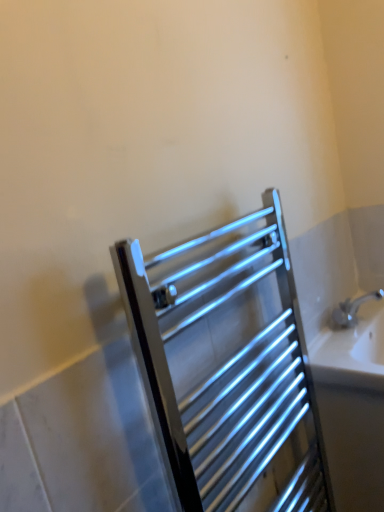
The height and width of the screenshot is (512, 384). Identify the location of chrome metallic towel rack at center. (228, 367).

This screenshot has height=512, width=384. What do you see at coordinates (228, 367) in the screenshot? I see `chrome metallic towel rack at center` at bounding box center [228, 367].

What is the approximate width of chrome metallic towel rack at center?

chrome metallic towel rack at center is 4.00 inches in width.

Where is `white glossy sink at lower right`? white glossy sink at lower right is located at coordinates (353, 407).

Describe the element at coordinates (353, 407) in the screenshot. The image size is (384, 512). I see `white glossy sink at lower right` at that location.

In order to click on chrome metallic towel rack at center in this screenshot , I will do `click(228, 367)`.

Is white glossy sink at lower right to the left or to the right of chrome metallic towel rack at center in the image?

Clearly, white glossy sink at lower right is on the right of chrome metallic towel rack at center in the image.

Is white glossy sink at lower right closer to the viewer compared to chrome metallic towel rack at center?

No, it is behind chrome metallic towel rack at center.

Is point (364, 477) closer or farther from the camera than point (203, 378)?

Clearly, point (364, 477) is more distant from the camera than point (203, 378).

From the image's perspective, is white glossy sink at lower right located above or below chrome metallic towel rack at center?

white glossy sink at lower right is situated lower than chrome metallic towel rack at center in the image.

From a real-world perspective, which is physically above, white glossy sink at lower right or chrome metallic towel rack at center?

In real-world perspective, chrome metallic towel rack at center is above.

Is white glossy sink at lower right wider or thinner than chrome metallic towel rack at center?

In the image, white glossy sink at lower right appears to be wider than chrome metallic towel rack at center.

From their relative heights in the image, would you say white glossy sink at lower right is taller or shorter than chrome metallic towel rack at center?

Clearly, white glossy sink at lower right is shorter compared to chrome metallic towel rack at center.

Which of these two, white glossy sink at lower right or chrome metallic towel rack at center, is smaller?

chrome metallic towel rack at center.

Is white glossy sink at lower right inside the boundaries of chrome metallic towel rack at center, or outside?

The correct answer is: outside.

Are white glossy sink at lower right and chrome metallic towel rack at center making contact?

No, white glossy sink at lower right is not beside chrome metallic towel rack at center.

Does white glossy sink at lower right turn towards chrome metallic towel rack at center?

No, white glossy sink at lower right is not turned towards chrome metallic towel rack at center.

What's the angular difference between white glossy sink at lower right and chrome metallic towel rack at center's facing directions?

There is a 0.783-degree angle between the facing directions of white glossy sink at lower right and chrome metallic towel rack at center.

Find the location of a particular element. This screenshot has height=512, width=384. screen door that is above the white glossy sink at lower right (from a real-world perspective) is located at coordinates (228, 367).

Is chrome metallic towel rack at center at the left side of white glossy sink at lower right?

Correct, you'll find chrome metallic towel rack at center to the left of white glossy sink at lower right.

Does chrome metallic towel rack at center lie in front of white glossy sink at lower right?

Yes, the depth of chrome metallic towel rack at center is less than that of white glossy sink at lower right.

Does point (247, 283) appear closer or farther from the camera than point (361, 379)?

Point (247, 283).

From the image's perspective, which is below, chrome metallic towel rack at center or white glossy sink at lower right?

From the image's view, white glossy sink at lower right is below.

From a real-world perspective, which object stands above the other?

From a 3D spatial view, chrome metallic towel rack at center is above.

Between chrome metallic towel rack at center and white glossy sink at lower right, which one has larger width?

white glossy sink at lower right.

Between chrome metallic towel rack at center and white glossy sink at lower right, which one has less height?

white glossy sink at lower right.

Which of these two, chrome metallic towel rack at center or white glossy sink at lower right, is bigger?

white glossy sink at lower right is bigger.

Is chrome metallic towel rack at center inside or outside of white glossy sink at lower right?

chrome metallic towel rack at center is spatially situated outside white glossy sink at lower right.

Is chrome metallic towel rack at center far from white glossy sink at lower right?

They are positioned close to each other.

Does chrome metallic towel rack at center turn towards white glossy sink at lower right?

A: No, chrome metallic towel rack at center is not turned towards white glossy sink at lower right.

How different are the orientations of chrome metallic towel rack at center and white glossy sink at lower right in degrees?

The angular difference between chrome metallic towel rack at center and white glossy sink at lower right is 0.783 degrees.

The width and height of the screenshot is (384, 512). In order to click on screen door in front of the white glossy sink at lower right in this screenshot , I will do `click(228, 367)`.

Where is `bath that is below the chrome metallic towel rack at center (from the image's perspective)`? The width and height of the screenshot is (384, 512). bath that is below the chrome metallic towel rack at center (from the image's perspective) is located at coordinates (353, 407).

The width and height of the screenshot is (384, 512). Find the location of `screen door above the white glossy sink at lower right (from the image's perspective)`. screen door above the white glossy sink at lower right (from the image's perspective) is located at coordinates (228, 367).